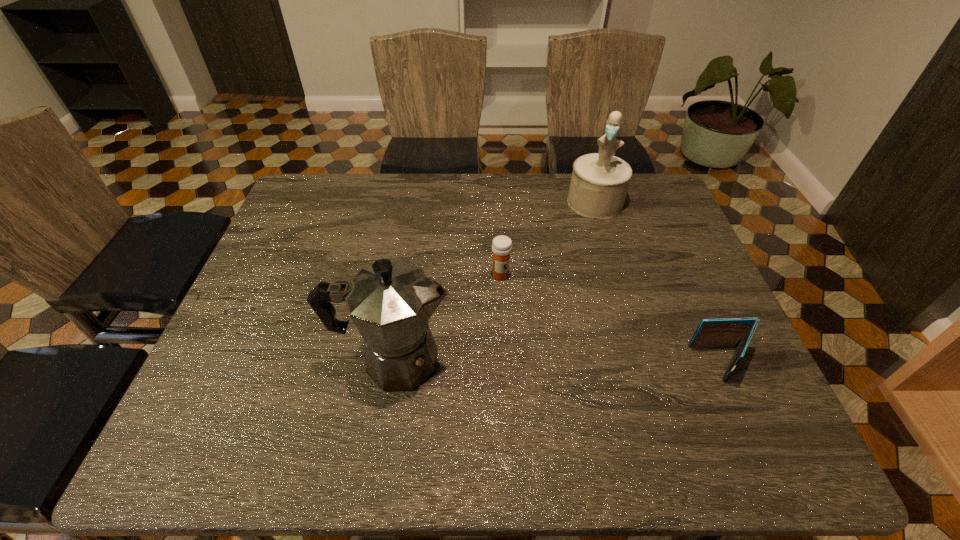
Identify the location of the closest object to the farthest object. point(501,245).

Locate which object is the second closest to the farthest object. Please provide its 2D coordinates. Your answer should be formatted as a tuple, i.e. [(x, y)], where the tuple contains the x and y coordinates of a point satisfying the conditions above.

[(731, 332)]

The image size is (960, 540). Identify the location of free space that satisfies the following two spatial constraints: 1. on the back side of the farthest object; 2. on the right side of the medicine. coord(497,202).